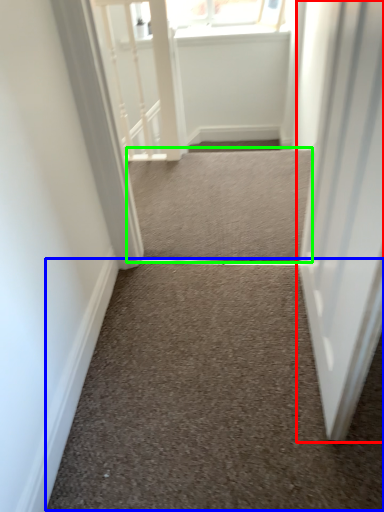
Question: Which is nearer to the door (highlighted by a red box)? stairwell (highlighted by a blue box) or stairwell (highlighted by a green box).

Choices:
 (A) stairwell
 (B) stairwell

Answer: (A)